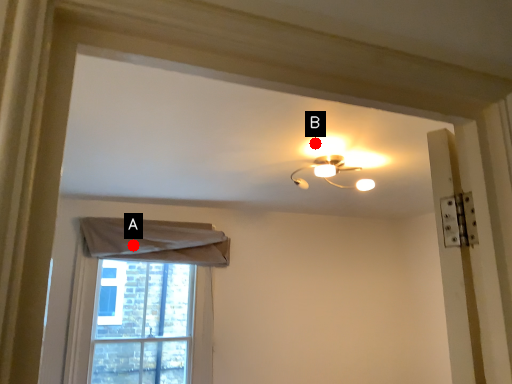
Question: Two points are circled on the image, labeled by A and B beside each circle. Among these points, which one is farthest from the camera?

Choices:
 (A) A is further
 (B) B is further

Answer: (A)